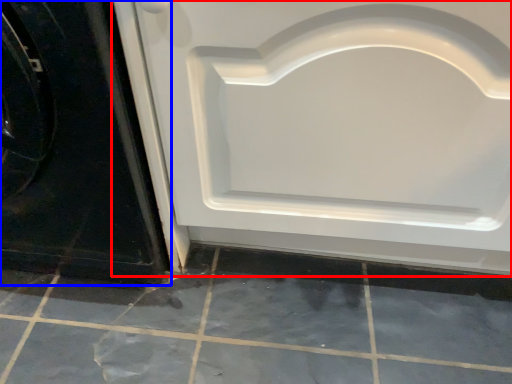
Question: Which object appears farthest to the camera in this image, door (highlighted by a red box) or door (highlighted by a blue box)?

Choices:
 (A) door
 (B) door

Answer: (B)